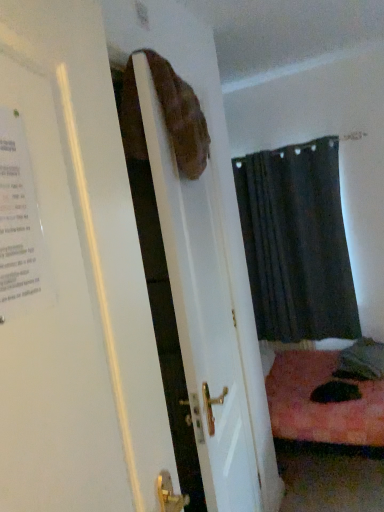
Question: Would you say matte brown bag at upper center is inside or outside dark fabric curtain at center?

Choices:
 (A) outside
 (B) inside

Answer: (A)

Question: Is matte brown bag at upper center to the left or to the right of dark fabric curtain at center in the image?

Choices:
 (A) right
 (B) left

Answer: (B)

Question: Estimate the real-world distances between objects in this image. Which object is closer to the white paper poster at left?

Choices:
 (A) dark fabric curtain at center
 (B) matte brown bag at upper center

Answer: (B)

Question: Considering the real-world distances, which object is closest to the dark fabric curtain at center?

Choices:
 (A) matte brown bag at upper center
 (B) white paper poster at left

Answer: (A)